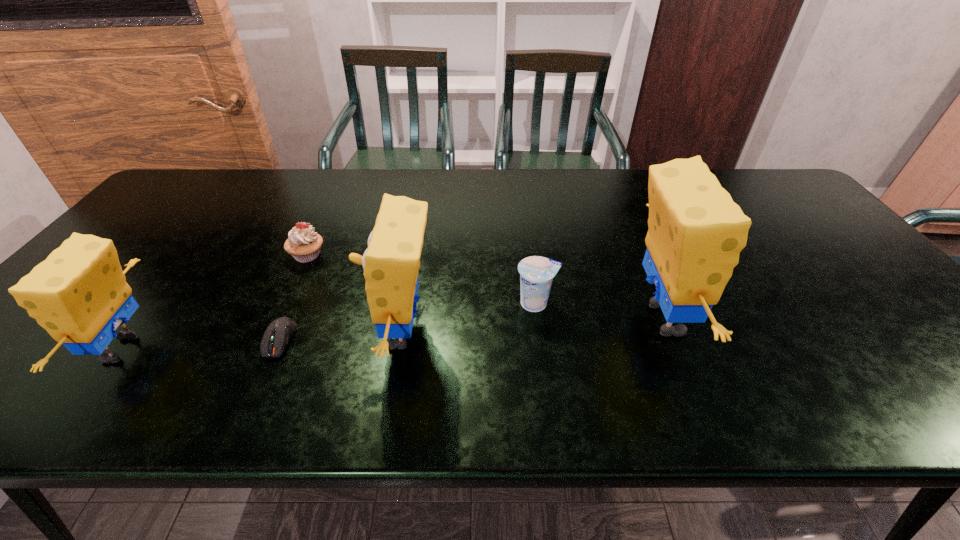
Locate an element on the screen. This screenshot has height=540, width=960. the shortest sponge is located at coordinates (79, 295).

The width and height of the screenshot is (960, 540). Find the location of `the leftmost object`. the leftmost object is located at coordinates (79, 295).

Locate an element on the screen. the second sponge from right to left is located at coordinates (391, 263).

I want to click on the fourth object from left to right, so click(391, 263).

Image resolution: width=960 pixels, height=540 pixels. Find the location of `the rightmost sponge`. the rightmost sponge is located at coordinates (696, 232).

Identify the location of cupcake. The height and width of the screenshot is (540, 960). (304, 244).

The width and height of the screenshot is (960, 540). Identify the location of the second object from right to left. (536, 273).

The height and width of the screenshot is (540, 960). What are the coordinates of `the shortest object` in the screenshot? It's located at (279, 332).

The width and height of the screenshot is (960, 540). I want to click on vacant space located 0.130m on the face of the leftmost object, so click(x=34, y=349).

Identify the location of vacant position located on the face of the leftmost object. (57, 349).